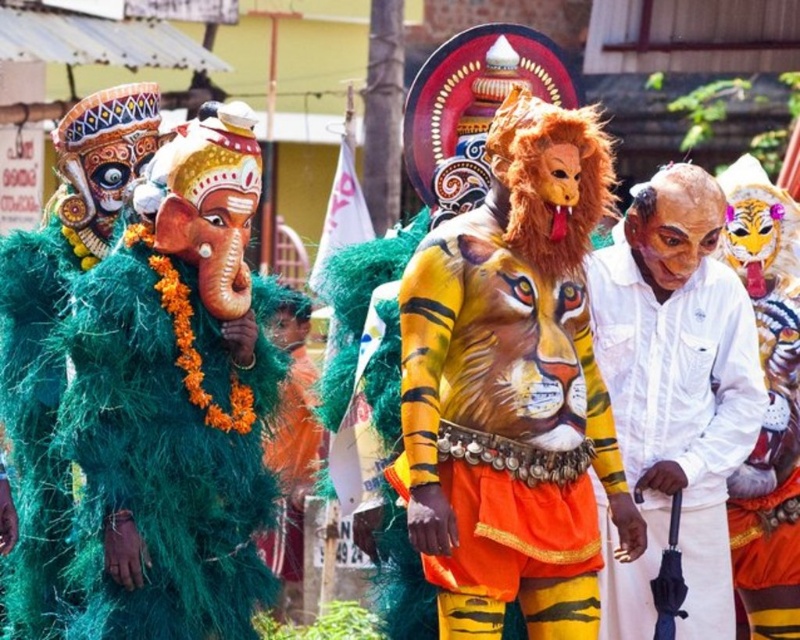
Question: Does painted tiger body art at center appear on the right side of white cotton shirt at center?

Choices:
 (A) no
 (B) yes

Answer: (A)

Question: Is painted tiger body art at center smaller than white cotton shirt at center?

Choices:
 (A) no
 (B) yes

Answer: (A)

Question: Can you confirm if painted tiger body art at center is thinner than white cotton shirt at center?

Choices:
 (A) no
 (B) yes

Answer: (A)

Question: Which of the following is the farthest from the observer?

Choices:
 (A) (572, 538)
 (B) (650, 480)

Answer: (B)